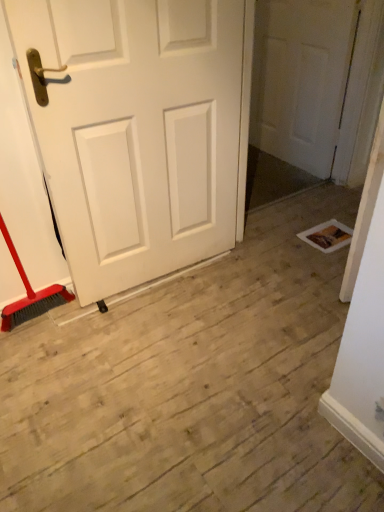
Question: Would you say white matte door at left, arranged as the first door when viewed from the front, contains white matte door at upper right, the 1th door viewed from the right?

Choices:
 (A) no
 (B) yes

Answer: (A)

Question: Is white matte door at left, which is counted as the 2th door, starting from the right, positioned beyond the bounds of white matte door at upper right, which appears as the 2th door when viewed from the left?

Choices:
 (A) yes
 (B) no

Answer: (A)

Question: Considering the relative sizes of white matte door at left, which is counted as the 2th door, starting from the right, and white matte door at upper right, the 2th door positioned from the front, in the image provided, is white matte door at left, which is counted as the 2th door, starting from the right, bigger than white matte door at upper right, the 2th door positioned from the front,?

Choices:
 (A) yes
 (B) no

Answer: (A)

Question: Is white matte door at left, marked as the second door in a back-to-front arrangement, to the left of white matte door at upper right, the 1th door viewed from the right, from the viewer's perspective?

Choices:
 (A) no
 (B) yes

Answer: (B)

Question: Would you consider white matte door at left, which appears as the 1th door when viewed from the left, to be distant from white matte door at upper right, which appears as the 2th door when viewed from the left?

Choices:
 (A) yes
 (B) no

Answer: (A)

Question: Is white matte door at left, arranged as the first door when viewed from the front, facing towards white matte door at upper right, the 1th door viewed from the right?

Choices:
 (A) no
 (B) yes

Answer: (A)

Question: Is white matte door at upper right, the first door in the back-to-front sequence, aimed at white matte door at left, which appears as the 1th door when viewed from the left?

Choices:
 (A) no
 (B) yes

Answer: (B)

Question: Considering the relative sizes of white matte door at upper right, the first door in the back-to-front sequence, and white matte door at left, marked as the second door in a back-to-front arrangement, in the image provided, is white matte door at upper right, the first door in the back-to-front sequence, bigger than white matte door at left, marked as the second door in a back-to-front arrangement,?

Choices:
 (A) yes
 (B) no

Answer: (B)

Question: Is white matte door at upper right, the 2th door positioned from the front, closer to camera compared to white matte door at left, marked as the second door in a back-to-front arrangement?

Choices:
 (A) no
 (B) yes

Answer: (A)

Question: Considering the relative sizes of white matte door at upper right, the 2th door positioned from the front, and white matte door at left, which appears as the 1th door when viewed from the left, in the image provided, is white matte door at upper right, the 2th door positioned from the front, smaller than white matte door at left, which appears as the 1th door when viewed from the left,?

Choices:
 (A) no
 (B) yes

Answer: (B)

Question: Could white matte door at left, which is counted as the 2th door, starting from the right, be considered to be inside white matte door at upper right, the 2th door positioned from the front?

Choices:
 (A) no
 (B) yes

Answer: (A)

Question: Is white matte door at upper right, the 2th door positioned from the front, wider than white matte door at left, which is counted as the 2th door, starting from the right?

Choices:
 (A) yes
 (B) no

Answer: (B)

Question: In terms of width, does white matte door at left, which is counted as the 2th door, starting from the right, look wider or thinner when compared to white matte door at upper right, the first door in the back-to-front sequence?

Choices:
 (A) thin
 (B) wide

Answer: (B)